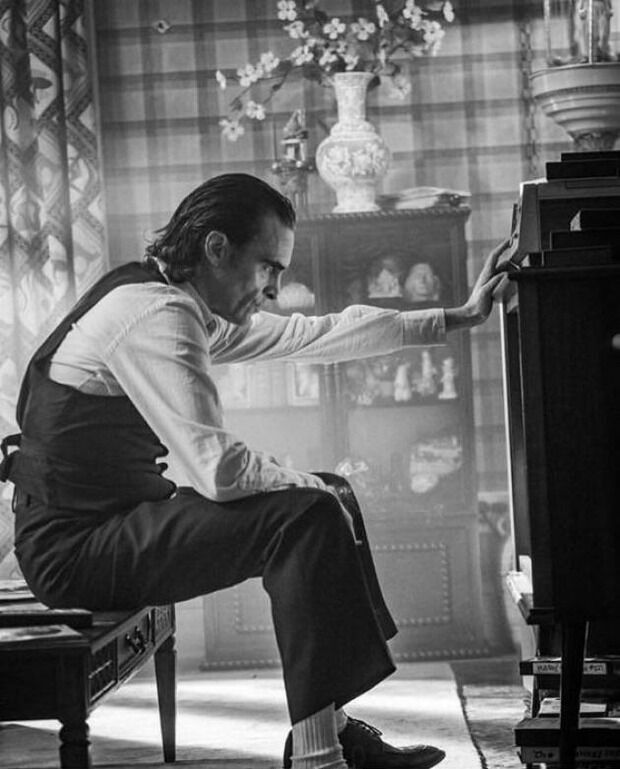
This screenshot has height=769, width=620. What are the coordinates of `curtain` in the screenshot? It's located at (33, 164).